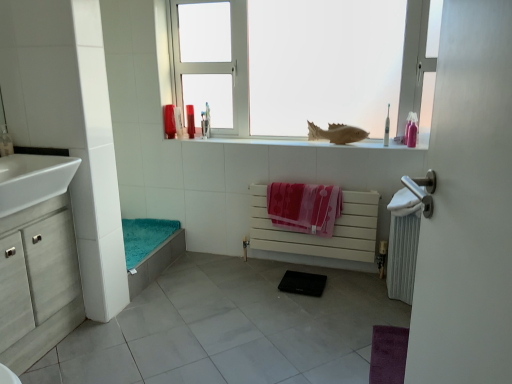
Where is `vacant space to the left of pink matte bottle at upper right, arranged as the first toiletry when viewed from the right`? vacant space to the left of pink matte bottle at upper right, arranged as the first toiletry when viewed from the right is located at coordinates (389, 142).